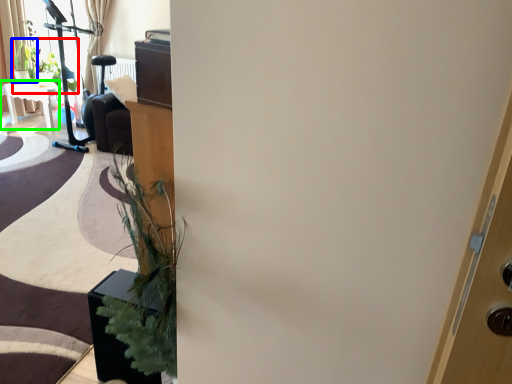
Question: Based on their relative distances, which object is farther from plant (highlighted by a red box)? Choose from plant (highlighted by a blue box) and table (highlighted by a green box).

Choices:
 (A) plant
 (B) table

Answer: (B)